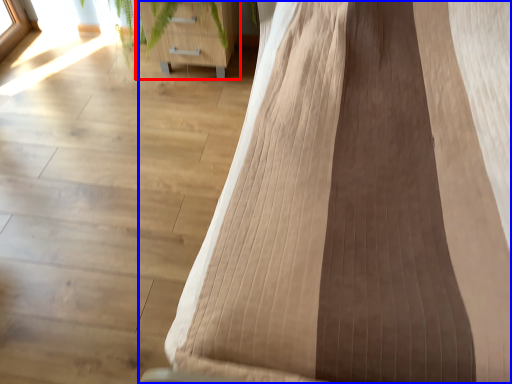
Question: Which of the following is the farthest to the observer, furniture (highlighted by a red box) or furniture (highlighted by a blue box)?

Choices:
 (A) furniture
 (B) furniture

Answer: (A)